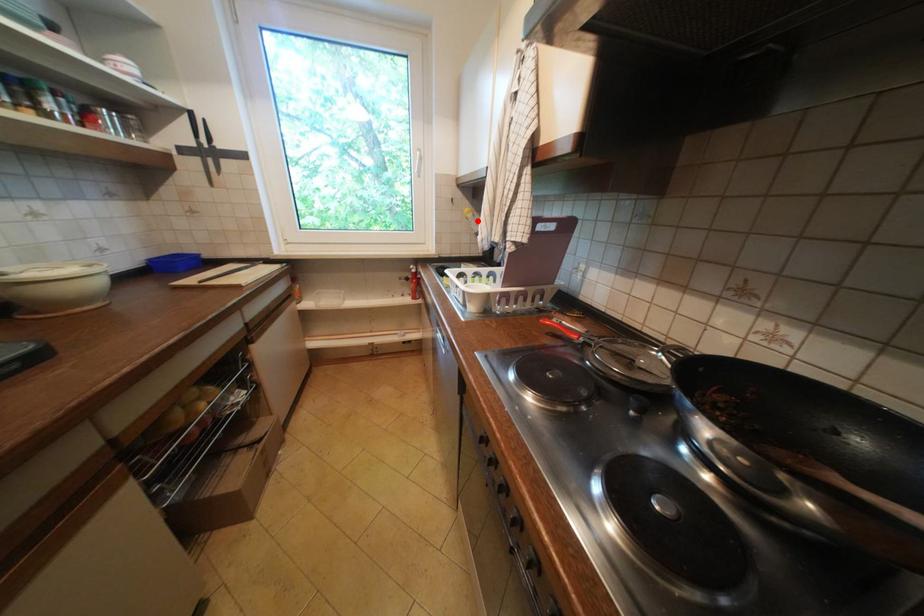
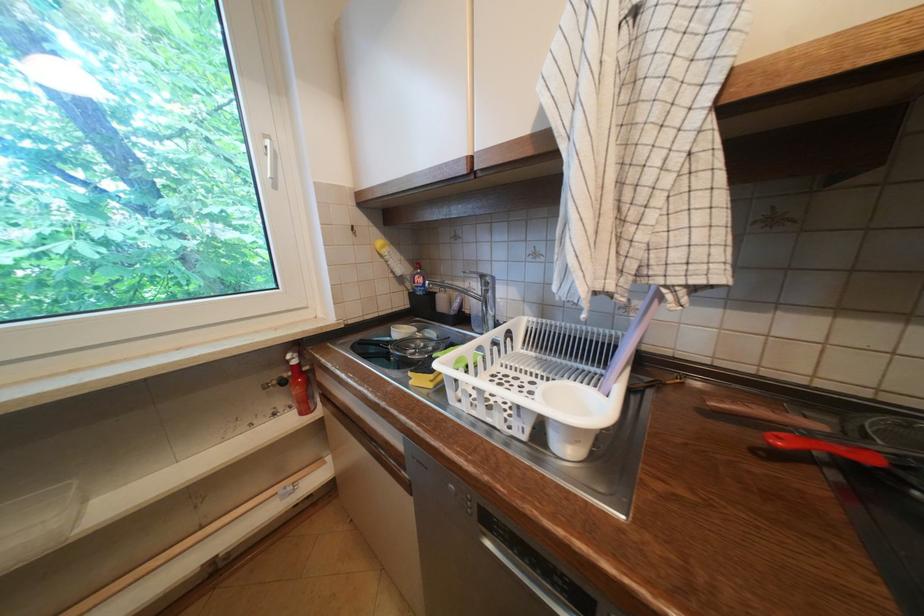
Question: I am providing you with two images of the same scene from different viewpoints. In image1, a red point is highlighted. Considering the same 3D point in image2, which of the following is correct?

Choices:
 (A) It is closer
 (B) It is farther

Answer: (B)